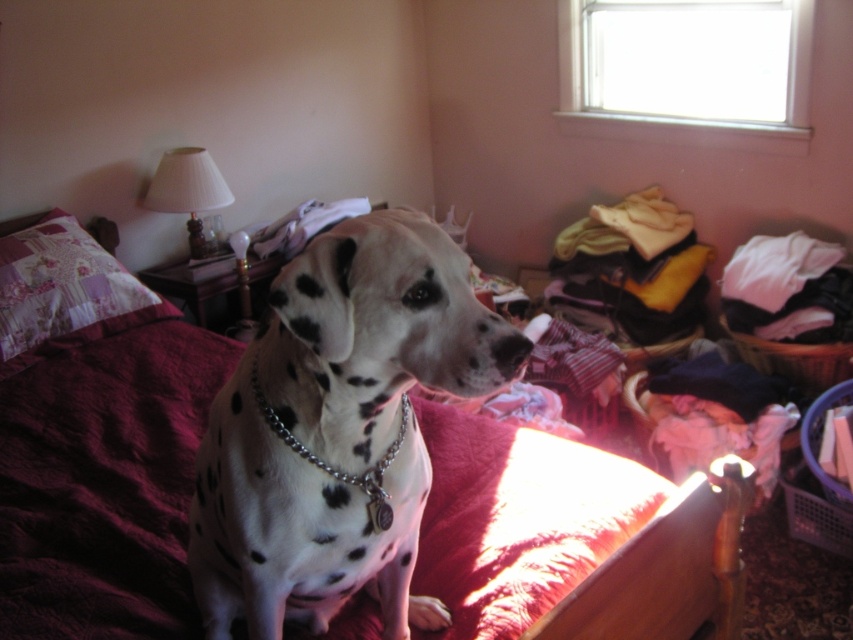
Is maroon quilted bed at center wider than white-spotted fur at center?

Correct, the width of maroon quilted bed at center exceeds that of white-spotted fur at center.

Identify the location of maroon quilted bed at center. (103, 484).

Is point (473, 625) more distant than point (280, 445)?

Yes, point (473, 625) is behind point (280, 445).

Where is `maroon quilted bed at center`? maroon quilted bed at center is located at coordinates (103, 484).

Who is more distant from viewer, [178,552] or [352,476]?

The point [178,552] is more distant.

Where is `maroon quilted bed at center`? The width and height of the screenshot is (853, 640). maroon quilted bed at center is located at coordinates (103, 484).

Is the position of maroon quilted bed at center less distant than that of patchwork fabric pillow at upper left?

Yes, it is.

I want to click on maroon quilted bed at center, so click(x=103, y=484).

Where is `maroon quilted bed at center`? The image size is (853, 640). maroon quilted bed at center is located at coordinates (103, 484).